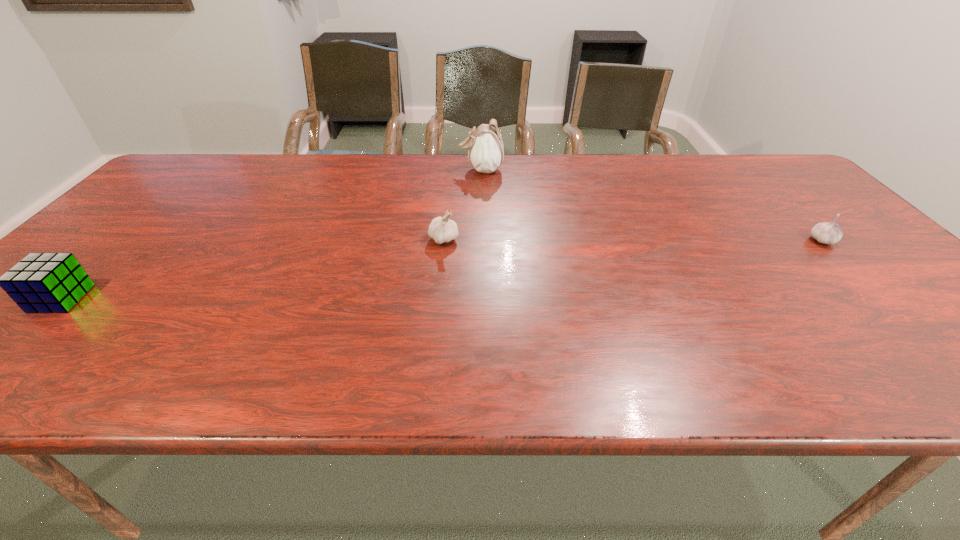
Locate an element on the screen. The width and height of the screenshot is (960, 540). blank area located on the front of the left garlic is located at coordinates (439, 291).

Locate an element on the screen. Image resolution: width=960 pixels, height=540 pixels. vacant space located 0.360m on the back of the cube is located at coordinates (161, 202).

The width and height of the screenshot is (960, 540). Identify the location of vacant space located 0.200m on the front of the right garlic. pos(885,304).

The image size is (960, 540). I want to click on object that is at the far edge, so click(486, 152).

Where is `object present at the left edge`? The width and height of the screenshot is (960, 540). object present at the left edge is located at coordinates (41, 282).

At what (x,y) coordinates should I click in order to perform the action: click on object situated at the right edge. Please return your answer as a coordinate pair (x, y). Looking at the image, I should click on (830, 233).

This screenshot has height=540, width=960. What are the coordinates of `free space at the far edge` in the screenshot? It's located at (482, 179).

This screenshot has width=960, height=540. I want to click on blank space at the near edge of the desktop, so pos(241,384).

Where is `vacant space at the left edge of the desktop`? This screenshot has width=960, height=540. vacant space at the left edge of the desktop is located at coordinates (91, 299).

Locate an element on the screen. The image size is (960, 540). vacant space at the right edge of the desktop is located at coordinates (770, 205).